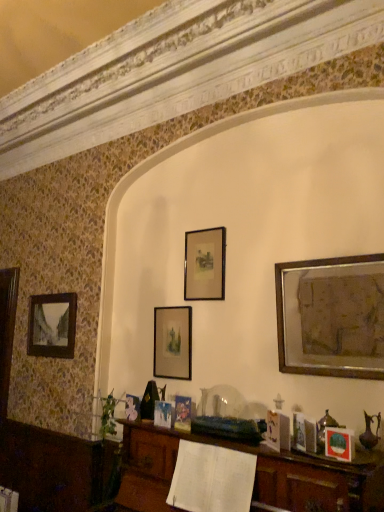
Question: From a real-world perspective, is matte black picture frame at center, which is counted as the fourth picture frame, starting from the front, physically located above or below matte black picture frame at lower right, the fourth picture frame in the left-to-right sequence?

Choices:
 (A) below
 (B) above

Answer: (B)

Question: In terms of size, does matte black picture frame at center, which is the 2th picture frame from back to front, appear bigger or smaller than matte black picture frame at lower right, marked as the fifth picture frame in a back-to-front arrangement?

Choices:
 (A) big
 (B) small

Answer: (A)

Question: Which of these objects is positioned farthest from the gold metallic picture frame at upper right, which is counted as the fourth picture frame, starting from the back?

Choices:
 (A) matte black picture frame at center, which ranks as the third picture frame in left-to-right order
 (B) matte black picture frame at center, which is the 2th picture frame from back to front
 (C) matte black picture frame at left, arranged as the 5th picture frame when viewed from the right
 (D) matte black picture frame at lower right, the fourth picture frame in the left-to-right sequence

Answer: (C)

Question: Considering the real-world distances, which object is closest to the matte black picture frame at center, acting as the second picture frame starting from the left?

Choices:
 (A) gold metallic picture frame at upper right, which is counted as the fourth picture frame, starting from the back
 (B) matte black picture frame at left, acting as the first picture frame starting from the back
 (C) matte black picture frame at lower right, marked as the fifth picture frame in a back-to-front arrangement
 (D) matte black picture frame at center, which ranks as the third picture frame in front-to-back order

Answer: (D)